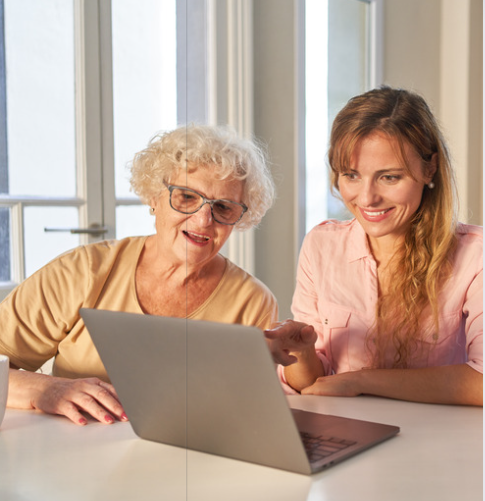
You are a GUI agent. You are given a task and a screenshot of the screen. Output one action in this format:
    pyautogui.click(x=<x>, y=<y>)
    Task: Click on the table
    This screenshot has width=485, height=501.
    Given the screenshot: What is the action you would take?
    pyautogui.click(x=140, y=460)